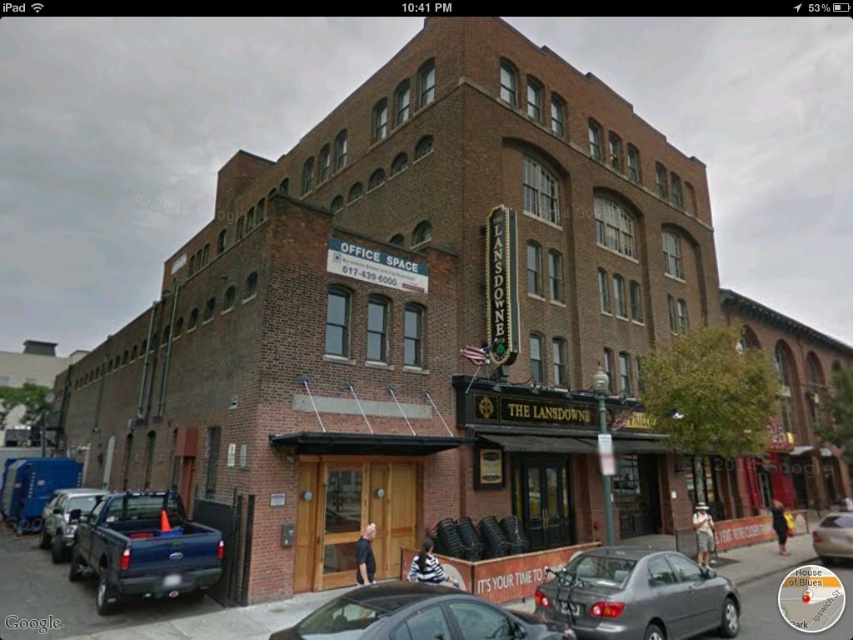
Can you confirm if matte gray sedan at lower center is positioned to the left of silver metallic sedan at center?

Indeed, matte gray sedan at lower center is positioned on the left side of silver metallic sedan at center.

Is point (590, 557) more distant than point (833, 522)?

No.

Is point (572, 580) positioned behind point (830, 538)?

That is False.

Find the location of a particular element. This screenshot has width=853, height=640. matte gray sedan at lower center is located at coordinates (637, 595).

Who is positioned more to the right, matte gray sedan at lower center or blue matte truck at lower left?

From the viewer's perspective, matte gray sedan at lower center appears more on the right side.

Is matte gray sedan at lower center below blue matte truck at lower left?

Correct, matte gray sedan at lower center is located below blue matte truck at lower left.

Describe the element at coordinates (637, 595) in the screenshot. The image size is (853, 640). I see `matte gray sedan at lower center` at that location.

The width and height of the screenshot is (853, 640). I want to click on matte gray sedan at lower center, so tap(637, 595).

Does shiny black sedan at center appear over silver metallic sedan at center?

Yes, shiny black sedan at center is above silver metallic sedan at center.

Where is `shiny black sedan at center`? shiny black sedan at center is located at coordinates (416, 616).

Find the location of a particular element. This screenshot has height=640, width=853. shiny black sedan at center is located at coordinates (416, 616).